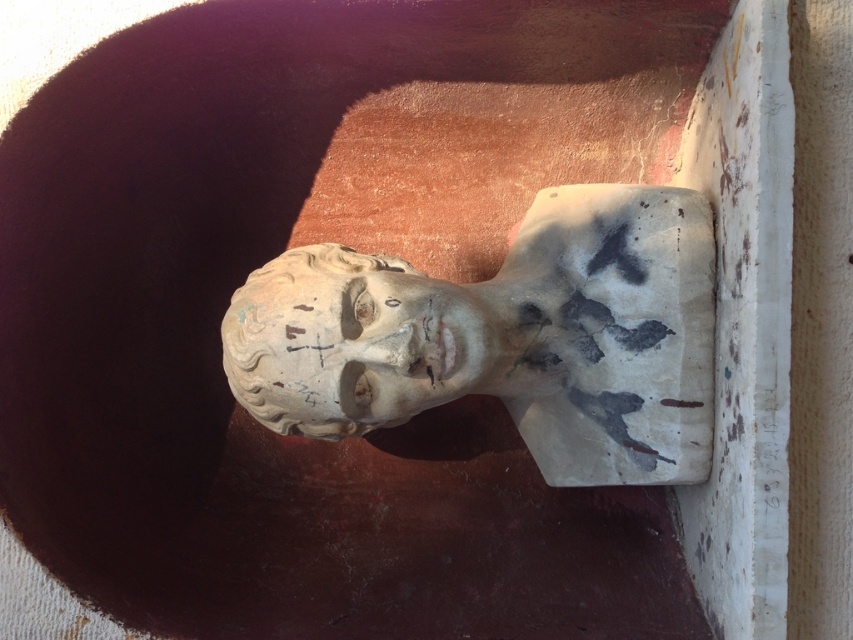
You are standing in front of a wall with a classical stone bust. There is a point marked at coordinates (505,337). What object is located at this point?

The point at (505,337) indicates the white plaster bust at center.

You are an art conservator examining two busts in a museum. You notice the white plaster bust at center and the white stone bust at center. Which one is taller?

The white plaster bust at center is taller than the white stone bust at center.

You are an art conservator examining two busts in a museum. You notice the white plaster bust at center and the white stone bust at center. Which of the two has a greater width?

The white plaster bust at center has a greater width than the white stone bust at center according to the description provided.